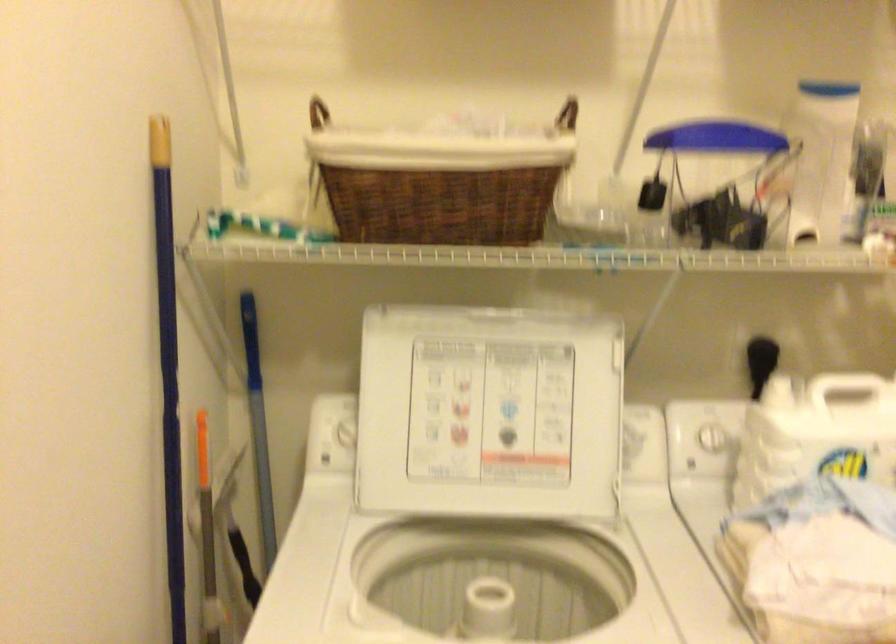
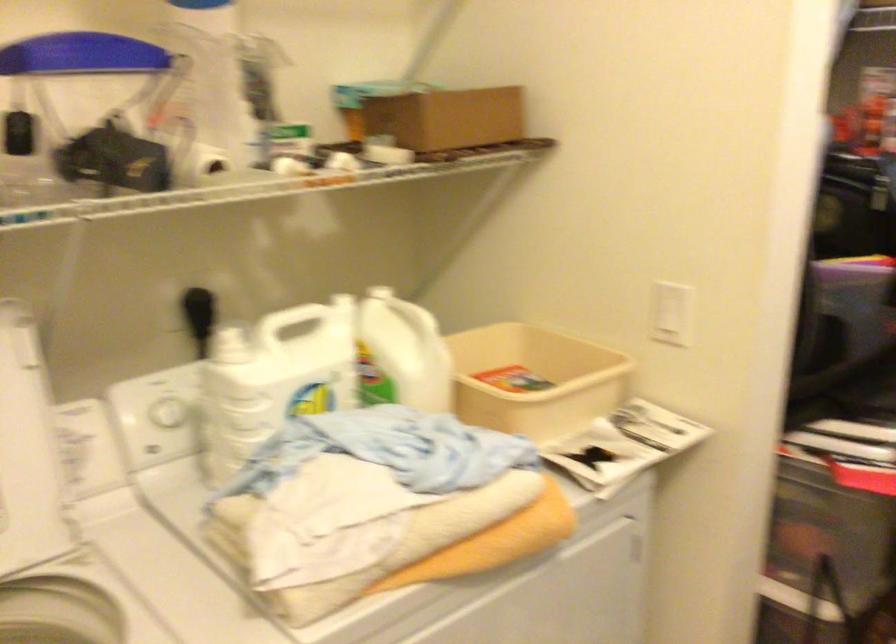
Find the pixel in the second image that matches point 765,353 in the first image.

(197, 303)